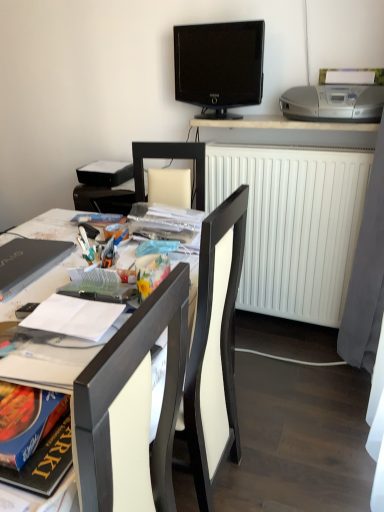
Question: From a real-world perspective, is black glossy tv at upper center above or below matte black laptop at left?

Choices:
 (A) above
 (B) below

Answer: (A)

Question: Considering the positions of black glossy tv at upper center and matte black laptop at left in the image, is black glossy tv at upper center taller or shorter than matte black laptop at left?

Choices:
 (A) short
 (B) tall

Answer: (B)

Question: Which object is the closest to the silver plastic printer at upper right?

Choices:
 (A) matte black desk at center, marked as the first desk in a left-to-right arrangement
 (B) white paper at left
 (C) white matte radiator at right
 (D) black matte book at upper center
 (E) hardcover book at center-left

Answer: (C)

Question: Which is nearer to the black matte book at upper center?

Choices:
 (A) white matte radiator at right
 (B) matte black desk at center, which is the 1th desk in bottom-to-top order
 (C) silver plastic printer at upper right
 (D) hardcover book at center-left
 (E) black glossy tv at upper center

Answer: (B)